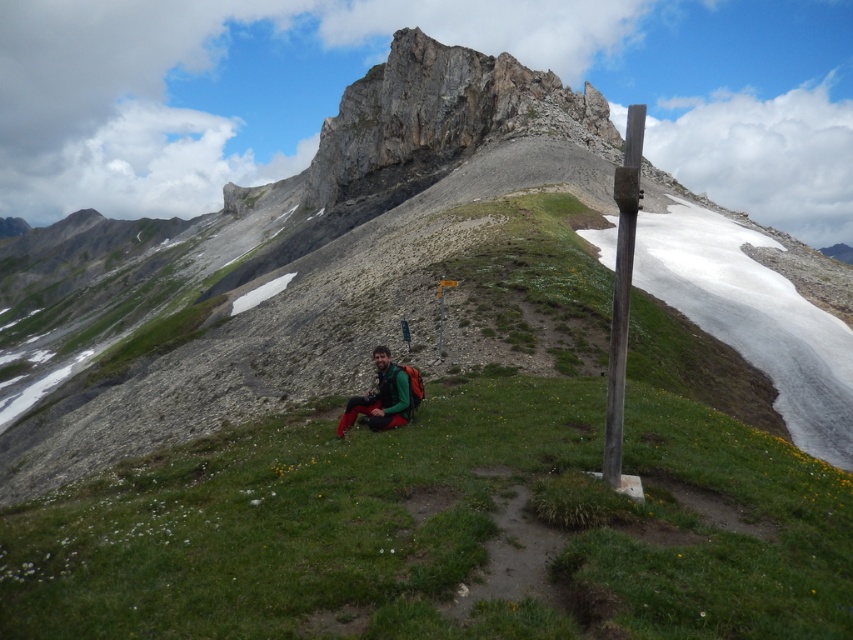
Question: Which object appears farthest from the camera in this image?

Choices:
 (A) smooth wooden post at right
 (B) green matte jacket at center

Answer: (B)

Question: Can you confirm if smooth wooden post at right is positioned above green matte jacket at center?

Choices:
 (A) yes
 (B) no

Answer: (A)

Question: Which point is closer to the camera?

Choices:
 (A) (340, 426)
 (B) (612, 342)

Answer: (B)

Question: Is the position of smooth wooden post at right less distant than that of green matte jacket at center?

Choices:
 (A) no
 (B) yes

Answer: (B)

Question: Which object appears closest to the camera in this image?

Choices:
 (A) green matte jacket at center
 (B) smooth wooden post at right

Answer: (B)

Question: Considering the relative positions of smooth wooden post at right and green matte jacket at center in the image provided, where is smooth wooden post at right located with respect to green matte jacket at center?

Choices:
 (A) above
 (B) below

Answer: (A)